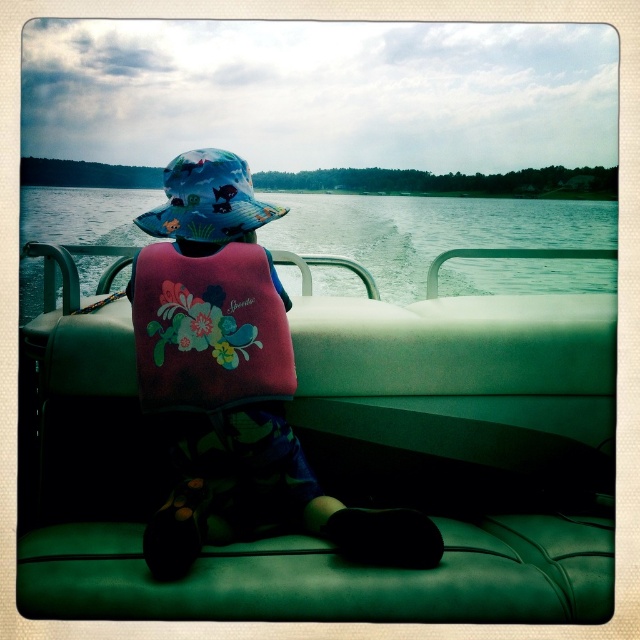
Question: In this image, where is green water at center located relative to floral fabric life jacket at center?

Choices:
 (A) left
 (B) right

Answer: (B)

Question: Which point is closer to the camera?

Choices:
 (A) printed fabric sunhat at center
 (B) floral fleece life vest at center
 (C) floral fabric life jacket at center
 (D) green water at center

Answer: (B)

Question: Does green water at center have a greater width compared to floral fabric life jacket at center?

Choices:
 (A) yes
 (B) no

Answer: (A)

Question: Considering the real-world distances, which object is farthest from the floral fabric life jacket at center?

Choices:
 (A) green water at center
 (B) printed fabric sunhat at center
 (C) floral fleece life vest at center

Answer: (A)

Question: Based on their relative distances, which object is farther from the printed fabric sunhat at center?

Choices:
 (A) floral fleece life vest at center
 (B) green water at center
 (C) floral fabric life jacket at center

Answer: (B)

Question: Is floral fleece life vest at center below printed fabric sunhat at center?

Choices:
 (A) no
 (B) yes

Answer: (B)